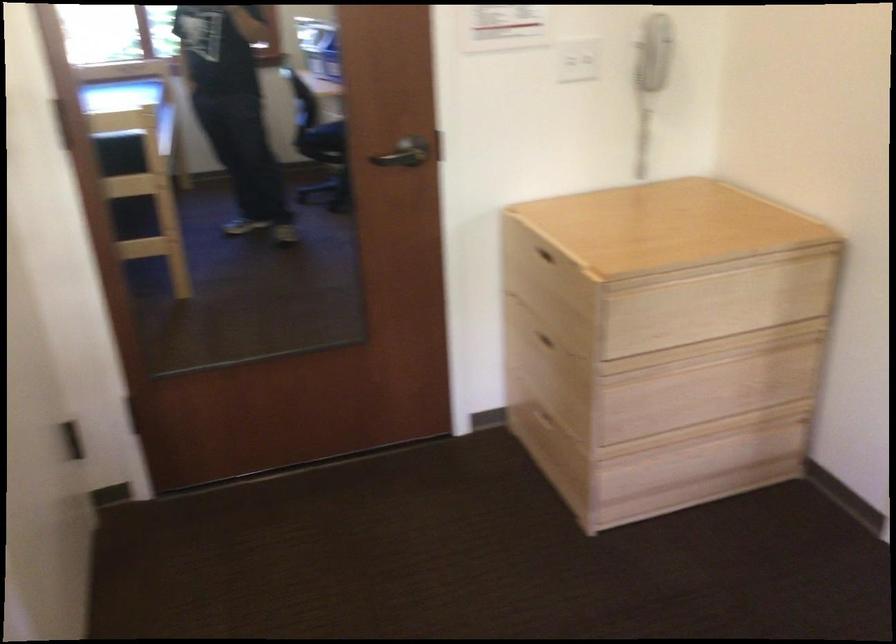
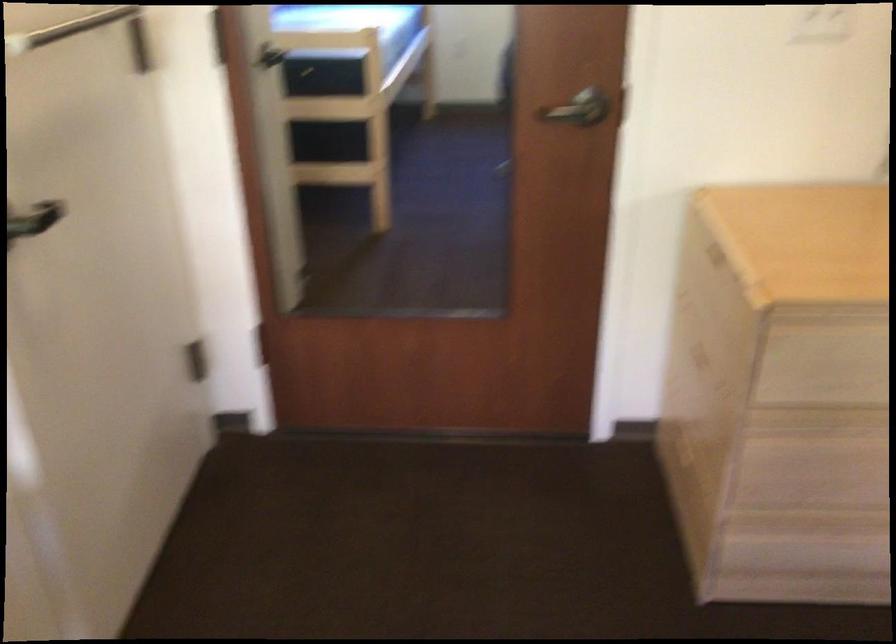
In the second image, find the point that corresponds to the point at 411,152 in the first image.

(583, 111)